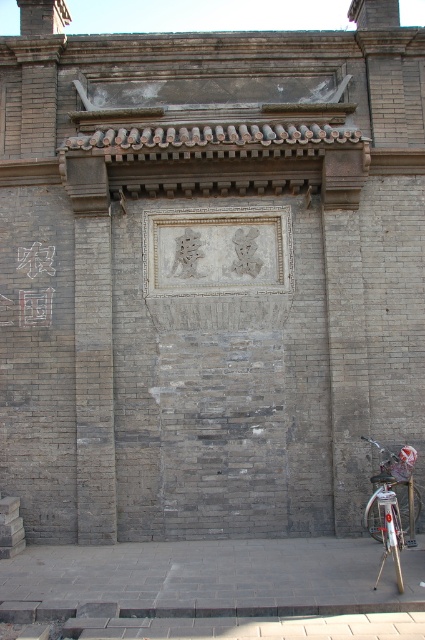
Between dark gray stone pavement at lower center and dark brown stone sign at upper center, which one has more height?

dark brown stone sign at upper center is taller.

Can you confirm if dark gray stone pavement at lower center is taller than dark brown stone sign at upper center?

In fact, dark gray stone pavement at lower center may be shorter than dark brown stone sign at upper center.

What do you see at coordinates (212, 573) in the screenshot? This screenshot has width=425, height=640. I see `dark gray stone pavement at lower center` at bounding box center [212, 573].

Locate an element on the screen. dark gray stone pavement at lower center is located at coordinates (212, 573).

Can you confirm if white stone plaque at center is taller than silver metallic bicycle at lower right?

No.

Can you confirm if white stone plaque at center is positioned above silver metallic bicycle at lower right?

Correct, white stone plaque at center is located above silver metallic bicycle at lower right.

Identify the location of white stone plaque at center. (217, 252).

Consider the image. Is white stone plaque at center thinner than dark brown stone sign at upper center?

No.

This screenshot has height=640, width=425. What do you see at coordinates (217, 252) in the screenshot?
I see `white stone plaque at center` at bounding box center [217, 252].

Does point (255, 292) come closer to viewer compared to point (34, 307)?

No, it is not.

Identify the location of white stone plaque at center. The width and height of the screenshot is (425, 640). (217, 252).